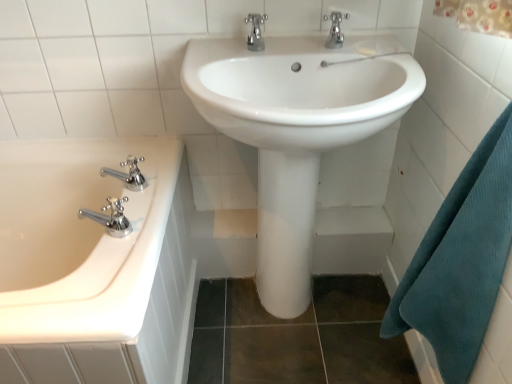
Locate an element on the screen. free spot in front of chrome/metallic faucet at left, placed as the 4th tap when sorted from top to bottom is located at coordinates (95, 286).